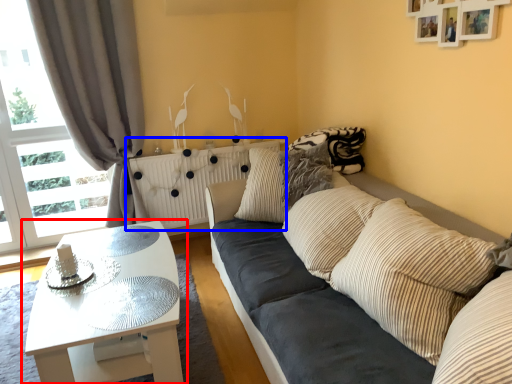
Question: Which point is closer to the camera, coffee table (highlighted by a red box) or radiator (highlighted by a blue box)?

Choices:
 (A) coffee table
 (B) radiator

Answer: (A)